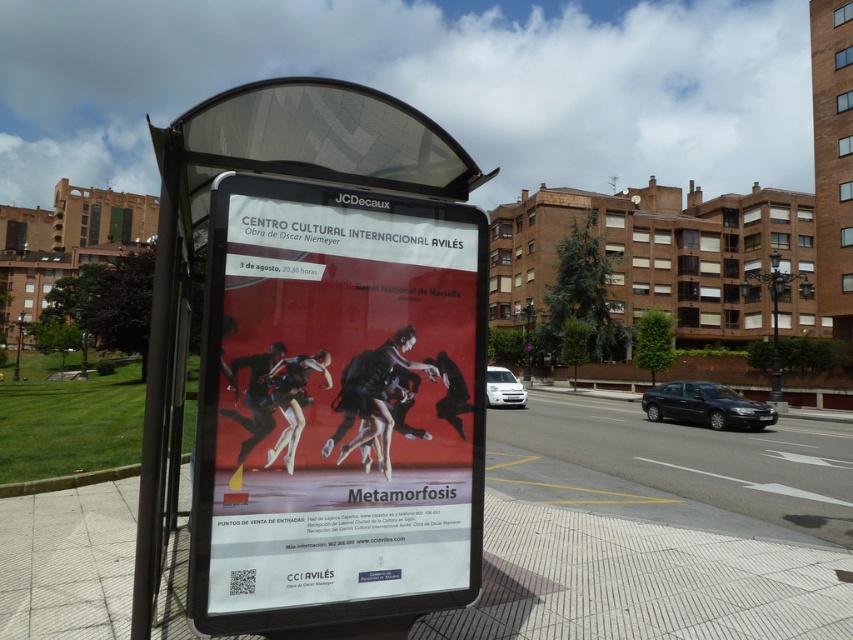
You are a pedestrian standing at the bus stop shelter. You want to read the text on the matte paper poster at center but your phone is on the smooth concrete pavement at center. Which object is closer to your right hand?

The matte paper poster at center is to the right of smooth concrete pavement at center, so the poster is closer to your right hand.

You are a photographer standing at the bus stop shelter. You want to take a photo that includes both the point at coordinates point (393, 435) and point (103, 588). Which point should you focus on first to ensure both are in focus?

You should focus on point (393, 435) first because it is closer to the camera than point (103, 588), ensuring both will be in focus when using a shallow depth of field.

You are a delivery person who needs to attach a new poster to the bus stop shelter. The new poster is the same size as the existing matte paper poster at center. Where should you place it so that it doesn not cover the smooth concrete pavement at center?

The matte paper poster at center has a greater height compared to smooth concrete pavement at center, so you should place the new poster at the same height as the existing matte paper poster at center to avoid covering the smooth concrete pavement at center.